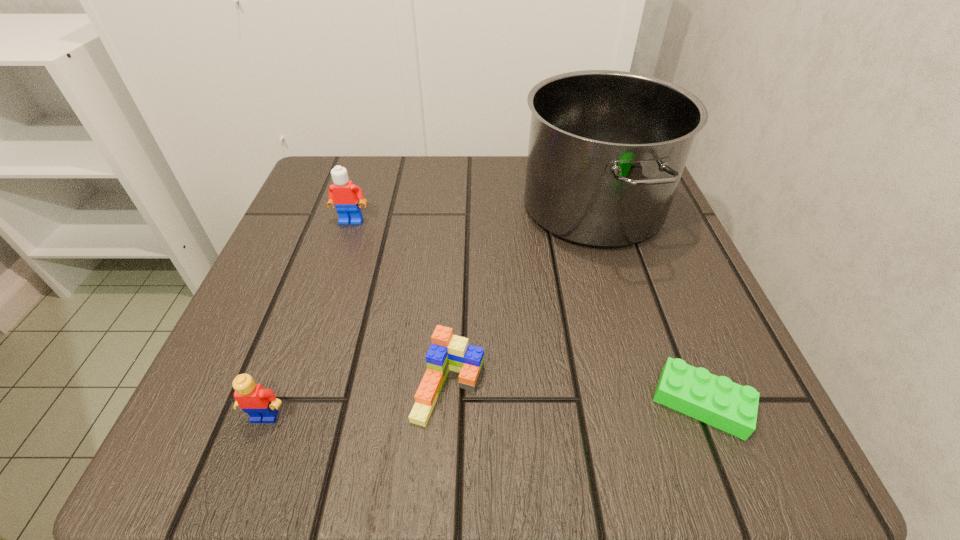
The width and height of the screenshot is (960, 540). I want to click on vacant area that lies between the tallest object and the third object from left to right, so click(521, 298).

Locate an element on the screen. free space that is in between the rightmost Lego and the third shortest Lego is located at coordinates (484, 409).

At what (x,y) coordinates should I click in order to perform the action: click on free space between the second tallest Lego and the fourth tallest object. Please return your answer as a coordinate pair (x, y). The image size is (960, 540). Looking at the image, I should click on (357, 402).

The width and height of the screenshot is (960, 540). What are the coordinates of `free space that is in between the saucepan and the farthest Lego` in the screenshot? It's located at (472, 214).

Identify the location of free point between the second shortest Lego and the third shortest object. This screenshot has height=540, width=960. (357, 402).

I want to click on vacant point located between the saucepan and the shortest Lego, so click(x=647, y=305).

Where is `object that is the second closest to the second shortest Lego`? This screenshot has height=540, width=960. object that is the second closest to the second shortest Lego is located at coordinates (607, 149).

Identify which object is the nearest to the saucepan. Please provide its 2D coordinates. Your answer should be formatted as a tuple, i.e. [(x, y)], where the tuple contains the x and y coordinates of a point satisfying the conditions above.

[(447, 352)]

Choose which Lego is the nearest neighbor to the shortest object. Please provide its 2D coordinates. Your answer should be formatted as a tuple, i.e. [(x, y)], where the tuple contains the x and y coordinates of a point satisfying the conditions above.

[(447, 352)]

Identify which Lego is located as the second nearest to the third tallest object. Please provide its 2D coordinates. Your answer should be formatted as a tuple, i.e. [(x, y)], where the tuple contains the x and y coordinates of a point satisfying the conditions above.

[(343, 194)]